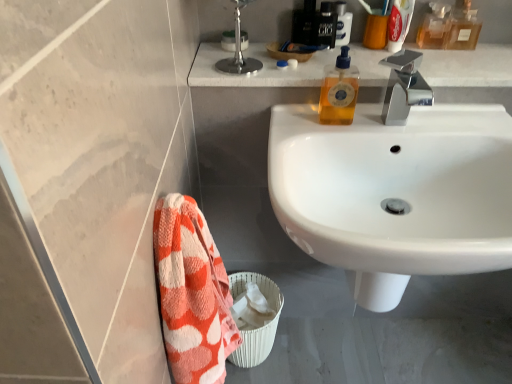
Locate an element on the screen. The width and height of the screenshot is (512, 384). vacant space to the right of translucent plastic mouthwash at upper center, marked as the 1th mouthwash in a left-to-right arrangement is located at coordinates (436, 56).